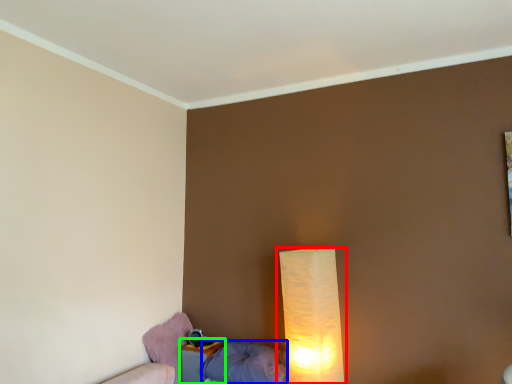
Question: Which object is the closest to the lamp (highlighted by a red box)? Choose among these: pillow (highlighted by a blue box) or nightstand (highlighted by a green box).

Choices:
 (A) pillow
 (B) nightstand

Answer: (A)